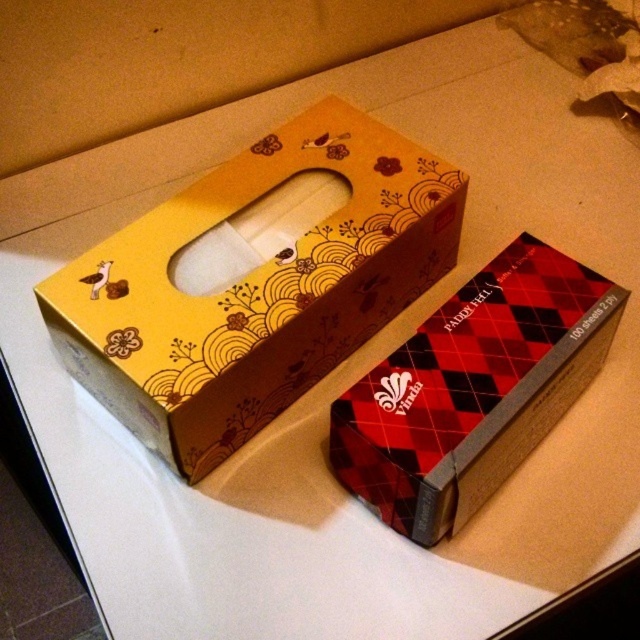
You are holding a camera 3.62 feet away from the matte brown tissue box at upper left. You want to take a photo of it. Is the distance sufficient to capture the entire box in the frame?

The matte brown tissue box at upper left is 3.62 feet away from the camera. Since the distance matches the required focal length for capturing the entire box, the camera can capture the entire matte brown tissue box at upper left in the frame.

You are trying to place a new tissue box in the larger cardboard box. The existing tissue boxes are the matte brown tissue box at upper left and the yellow and brown patterned tissue box at lower right. Where should you place the new tissue box to avoid overlapping with them?

The new tissue box should be placed in an area that does not overlap with the matte brown tissue box at upper left and the yellow and brown patterned tissue box at lower right. Since the matte brown tissue box is at point (253, 288) and the yellow and brown patterned tissue box is at lower right, the new box should be positioned in the remaining open space within the larger cardboard box.